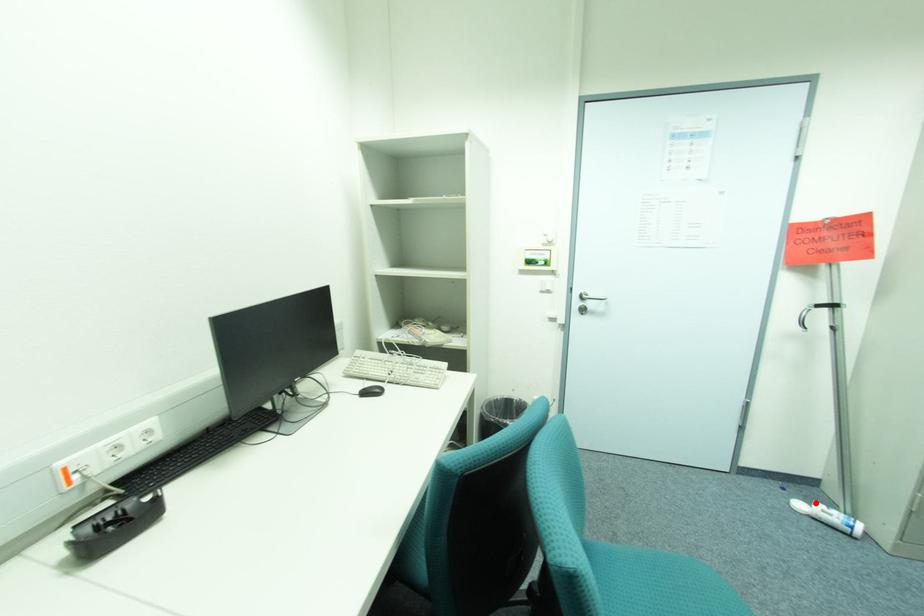
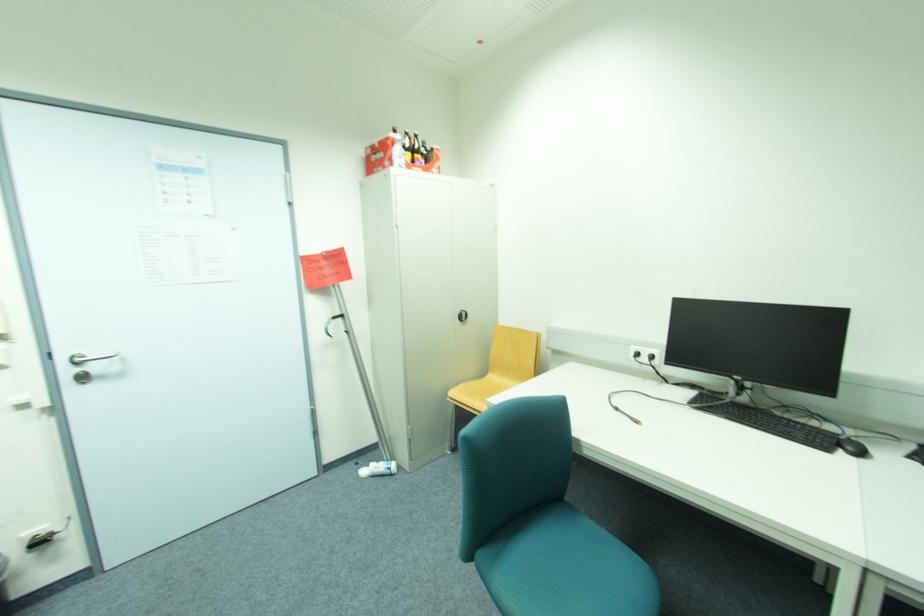
Question: I am providing you with two images of the same scene from different viewpoints. Image1 has a red point marked. In image2, the corresponding 3D location appears at what relative position? Reply with the corresponding letter.

Choices:
 (A) Closer
 (B) Farther

Answer: (B)